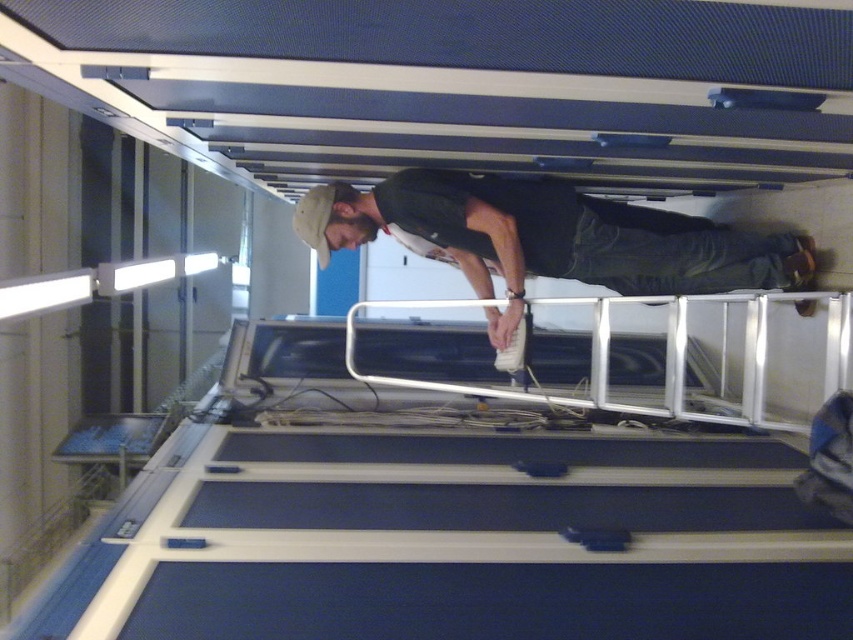
Question: Among these objects, which one is nearest to the camera?

Choices:
 (A) dark green fabric shirt at center
 (B) silver metallic rail at center

Answer: (B)

Question: Considering the relative positions of dark green fabric shirt at center and silver metallic rail at center in the image provided, where is dark green fabric shirt at center located with respect to silver metallic rail at center?

Choices:
 (A) right
 (B) left

Answer: (B)

Question: Does dark green fabric shirt at center appear under silver metallic rail at center?

Choices:
 (A) no
 (B) yes

Answer: (A)

Question: Is dark green fabric shirt at center below silver metallic rail at center?

Choices:
 (A) no
 (B) yes

Answer: (A)

Question: Among these points, which one is nearest to the camera?

Choices:
 (A) (630, 225)
 (B) (688, 301)

Answer: (B)

Question: Which point is farther from the camera taking this photo?

Choices:
 (A) (636, 278)
 (B) (711, 417)

Answer: (A)